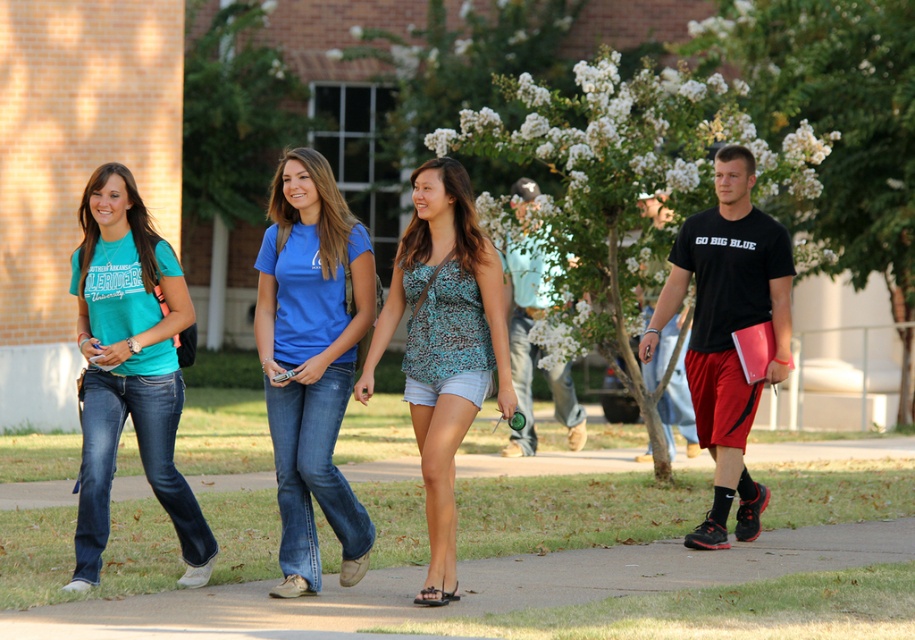
Can you confirm if blue denim jeans at center is taller than leopard print tank top at center?

Yes, blue denim jeans at center is taller than leopard print tank top at center.

Who is positioned more to the right, blue denim jeans at center or leopard print tank top at center?

leopard print tank top at center is more to the right.

Find the location of a particular element. The height and width of the screenshot is (640, 915). blue denim jeans at center is located at coordinates (311, 360).

What do you see at coordinates (128, 369) in the screenshot? I see `matte teal t-shirt at left` at bounding box center [128, 369].

Is matte teal t-shirt at left to the left of black matte t-shirt at center from the viewer's perspective?

Indeed, matte teal t-shirt at left is positioned on the left side of black matte t-shirt at center.

Between point (120, 196) and point (781, 301), which one is positioned in front?

Positioned in front is point (120, 196).

The width and height of the screenshot is (915, 640). I want to click on matte teal t-shirt at left, so click(128, 369).

Does matte teal t-shirt at left lie behind leopard print tank top at center?

Yes, matte teal t-shirt at left is further from the viewer.

Looking at this image, is matte teal t-shirt at left taller than leopard print tank top at center?

In fact, matte teal t-shirt at left may be shorter than leopard print tank top at center.

Is point (101, 232) closer to viewer compared to point (461, 227)?

No, (101, 232) is behind (461, 227).

Locate an element on the screen. matte teal t-shirt at left is located at coordinates (128, 369).